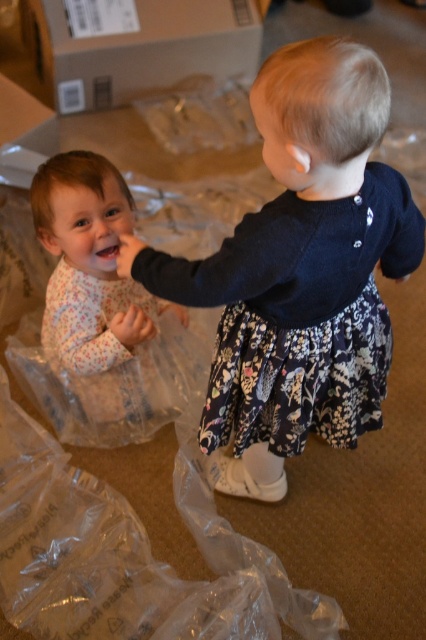
Question: Considering the real-world distances, which object is closest to the floral dress at left?

Choices:
 (A) floral pajamas at left
 (B) brown cardboard box at upper left

Answer: (A)

Question: Which object is positioned farthest from the floral pajamas at left?

Choices:
 (A) floral dress at left
 (B) brown cardboard box at upper left

Answer: (B)

Question: Can you confirm if floral pajamas at left is bigger than brown cardboard box at upper left?

Choices:
 (A) no
 (B) yes

Answer: (A)

Question: Which of the following is the farthest from the observer?

Choices:
 (A) brown cardboard box at upper left
 (B) floral dress at left
 (C) floral pajamas at left

Answer: (A)

Question: Where is floral dress at left located in relation to floral pajamas at left in the image?

Choices:
 (A) below
 (B) above

Answer: (A)

Question: Is floral pajamas at left positioned behind brown cardboard box at upper left?

Choices:
 (A) no
 (B) yes

Answer: (A)